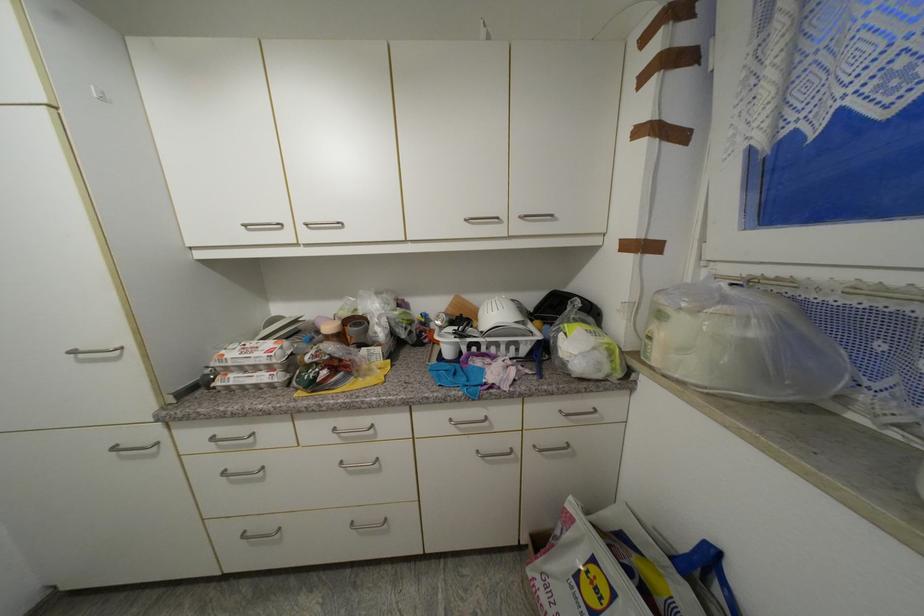
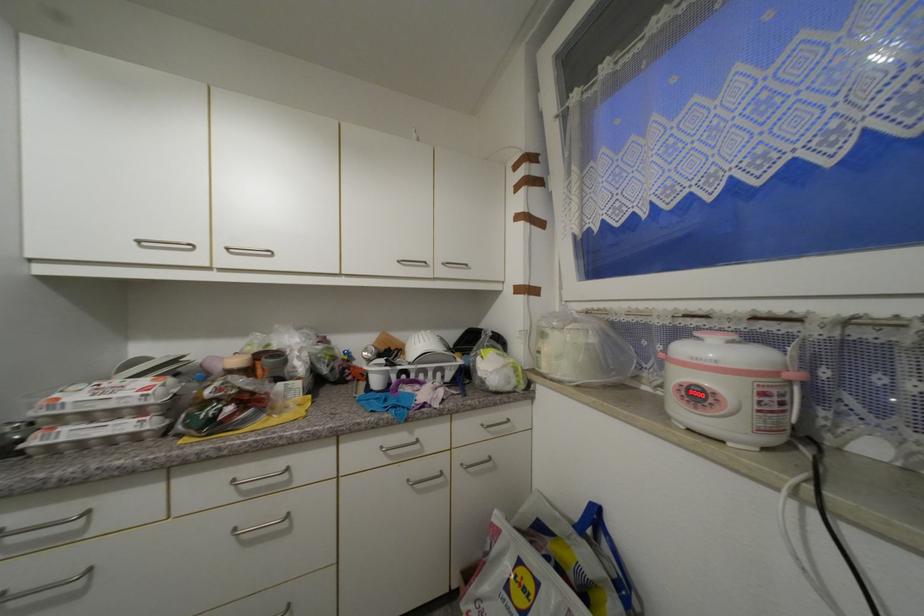
Question: The camera is either moving clockwise (left) or counter-clockwise (right) around the object. The first image is from the beginning of the video and the second image is from the end. Is the camera moving left or right when shooting the video?

Choices:
 (A) Left
 (B) Right

Answer: (A)